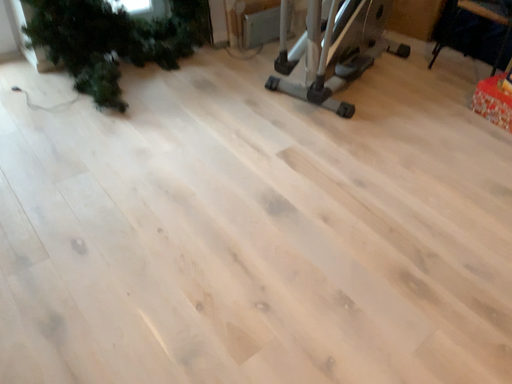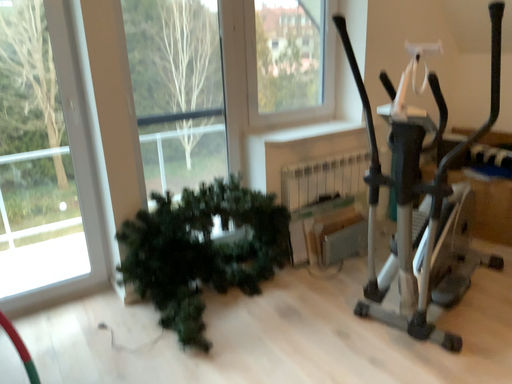
Question: Which way did the camera rotate in the video?

Choices:
 (A) rotated right
 (B) rotated left

Answer: (B)